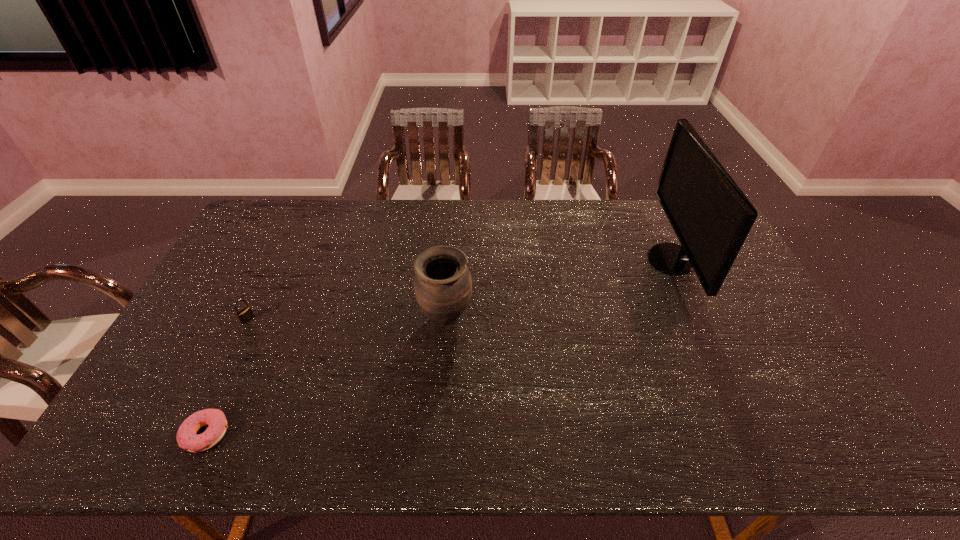
Where is `the tallest object`? The height and width of the screenshot is (540, 960). the tallest object is located at coordinates (711, 216).

Find the location of a particular element. computer monitor is located at coordinates (711, 216).

Find the location of a particular element. urn is located at coordinates (443, 286).

Find the location of a particular element. The width and height of the screenshot is (960, 540). the third shortest object is located at coordinates (443, 286).

Find the location of a particular element. The image size is (960, 540). the third tallest object is located at coordinates (246, 314).

At what (x,y) coordinates should I click in order to perform the action: click on the shortest object. Please return your answer as a coordinate pair (x, y). Looking at the image, I should click on (187, 438).

Locate an element on the screen. The height and width of the screenshot is (540, 960). the nearest object is located at coordinates (187, 438).

The height and width of the screenshot is (540, 960). Identify the location of vacant space situated 0.110m on the front-facing side of the tallest object. (615, 259).

Identify the location of vacant space located 0.110m on the front-facing side of the tallest object. (615, 259).

Locate an element on the screen. The width and height of the screenshot is (960, 540). vacant space positioned 0.120m on the front-facing side of the tallest object is located at coordinates (612, 259).